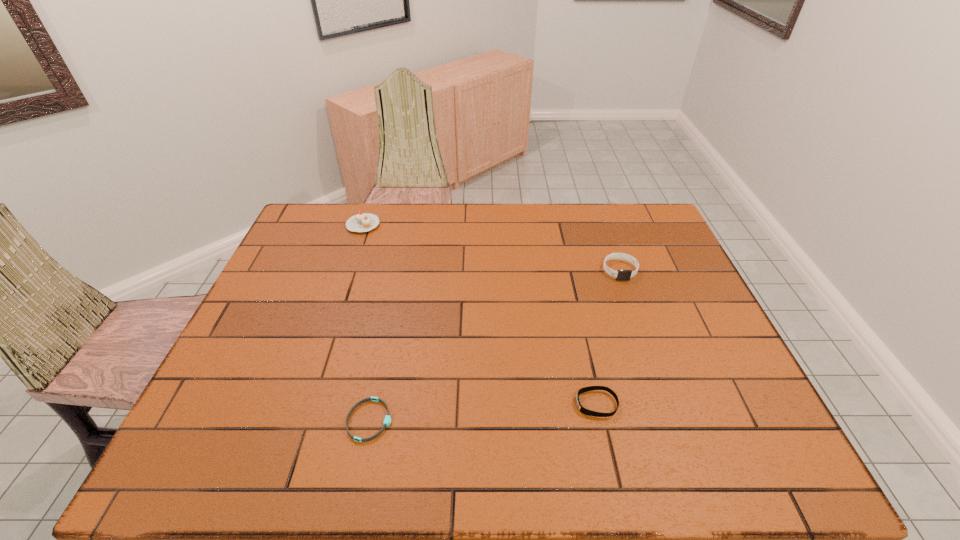
Locate an element on the screen. the farthest object is located at coordinates 362,222.

Find the location of a particular element. This screenshot has height=540, width=960. cupcake is located at coordinates (362, 222).

I want to click on the tallest wristband, so click(622, 275).

Locate an element on the screen. This screenshot has height=540, width=960. the rightmost object is located at coordinates (622, 275).

Find the location of `the second object from right to left`. the second object from right to left is located at coordinates (583, 410).

Locate an element on the screen. This screenshot has height=540, width=960. the second tallest wristband is located at coordinates (583, 410).

What are the coordinates of `the leftmost wristband` in the screenshot? It's located at (387, 420).

Locate an element on the screen. the second object from left to right is located at coordinates (387, 420).

I want to click on vacant space positioned on the left of the cupcake, so click(306, 225).

The image size is (960, 540). What are the coordinates of `vacant space located on the outer surface of the rightmost object` in the screenshot? It's located at (637, 321).